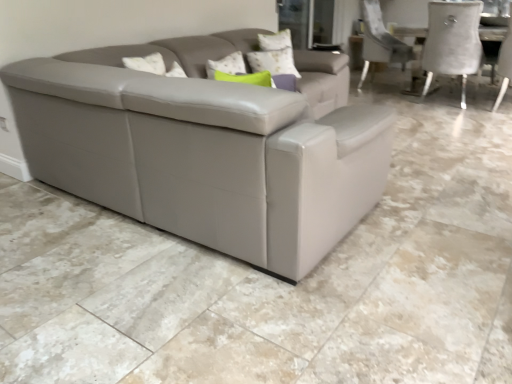
Image resolution: width=512 pixels, height=384 pixels. I want to click on white textured pillow at upper center, so click(x=273, y=61).

The width and height of the screenshot is (512, 384). Describe the element at coordinates (504, 65) in the screenshot. I see `white fabric chair at right` at that location.

You are a GUI agent. You are given a task and a screenshot of the screen. Output one action in this format:
    pyautogui.click(x=<x>, y=<y>)
    Task: Click on the transparent glass door at upper center
    
    Given the screenshot: What is the action you would take?
    pyautogui.click(x=307, y=21)

Considering the sizes of matte gray couch at center and white textured pillow at upper center in the image, is matte gray couch at center taller or shorter than white textured pillow at upper center?

Clearly, matte gray couch at center is shorter compared to white textured pillow at upper center.

Considering the relative sizes of matte gray couch at center and white textured pillow at upper center in the image provided, is matte gray couch at center bigger than white textured pillow at upper center?

Yes.

From the image's perspective, is matte gray couch at center located beneath white textured pillow at upper center?

Correct, matte gray couch at center appears lower than white textured pillow at upper center in the image.

Which is more to the right, matte gray couch at center or white textured pillow at upper center?

matte gray couch at center.

From a real-world perspective, is white textured pillow at upper center under matte gray couch at center?

Actually, white textured pillow at upper center is physically above matte gray couch at center in the real world.

Is white textured pillow at upper center inside or outside of matte gray couch at center?

white textured pillow at upper center exists outside the volume of matte gray couch at center.

Is matte gray couch at center at the back of white textured pillow at upper center?

That's not correct — white textured pillow at upper center is not looking away from matte gray couch at center.

Is point (286, 57) farther from camera compared to point (273, 253)?

Yes, it is behind point (273, 253).

Who is bigger, transparent glass door at upper center or white textured pillow at upper center?

With larger size is transparent glass door at upper center.

From a real-world perspective, is transparent glass door at upper center physically below white textured pillow at upper center?

No, from a real-world perspective, transparent glass door at upper center is not under white textured pillow at upper center.

Between point (303, 17) and point (287, 70), which one is positioned behind?

The point (303, 17) is farther.

Considering the sizes of transparent glass door at upper center and matte gray couch at center in the image, is transparent glass door at upper center wider or thinner than matte gray couch at center?

Clearly, transparent glass door at upper center has less width compared to matte gray couch at center.

What's the angular difference between transparent glass door at upper center and matte gray couch at center's facing directions?

There is a 0.0891-degree angle between the facing directions of transparent glass door at upper center and matte gray couch at center.

This screenshot has height=384, width=512. Find the location of `studio couch located on the right of transparent glass door at upper center`. studio couch located on the right of transparent glass door at upper center is located at coordinates (208, 146).

Looking at the image, does transparent glass door at upper center seem bigger or smaller compared to matte gray couch at center?

Clearly, transparent glass door at upper center is smaller in size than matte gray couch at center.

Relative to matte gray couch at center, is white fabric chair at right in front or behind?

Clearly, white fabric chair at right is behind matte gray couch at center.

Based on the photo, from a real-world perspective, is white fabric chair at right above or below matte gray couch at center?

white fabric chair at right is above matte gray couch at center.

Is white fabric chair at right facing towards matte gray couch at center?

No, white fabric chair at right does not turn towards matte gray couch at center.

From the picture: Considering the relative sizes of white fabric chair at right and matte gray couch at center in the image provided, is white fabric chair at right thinner than matte gray couch at center?

Indeed, white fabric chair at right has a lesser width compared to matte gray couch at center.

Is white textured pillow at upper center far from white fabric chair at right?

Yes, white textured pillow at upper center and white fabric chair at right are quite far apart.

Considering the positions of point (250, 57) and point (507, 58), is point (250, 57) closer or farther from the camera than point (507, 58)?

Point (250, 57) is closer to the camera than point (507, 58).

Is white textured pillow at upper center at the right side of white fabric chair at right?

No, white textured pillow at upper center is not to the right of white fabric chair at right.

Looking at this image, is white textured pillow at upper center outside of white fabric chair at right?

Indeed, white textured pillow at upper center is completely outside white fabric chair at right.

Between matte gray couch at center and transparent glass door at upper center, which one has less height?

matte gray couch at center is shorter.

From a real-world perspective, which is physically below, matte gray couch at center or transparent glass door at upper center?

matte gray couch at center.

Which is more to the right, matte gray couch at center or transparent glass door at upper center?

Positioned to the right is matte gray couch at center.

From the image's perspective, which one is positioned lower, matte gray couch at center or transparent glass door at upper center?

matte gray couch at center.

Image resolution: width=512 pixels, height=384 pixels. Identify the location of studio couch located below the white textured pillow at upper center (from the image's perspective). (208, 146).

Image resolution: width=512 pixels, height=384 pixels. In order to click on pillow above the matte gray couch at center (from the image's perspective) in this screenshot , I will do `click(273, 61)`.

Based on the photo, based on their spatial positions, is white fabric chair at right or matte gray couch at center further from transparent glass door at upper center?

Among the two, matte gray couch at center is located further to transparent glass door at upper center.

Based on their spatial positions, is matte gray couch at center or white fabric chair at right closer to transparent glass door at upper center?

white fabric chair at right lies closer to transparent glass door at upper center than the other object.

When comparing their distances from white fabric chair at right, does transparent glass door at upper center or white textured pillow at upper center seem further?

Among the two, white textured pillow at upper center is located further to white fabric chair at right.

Considering their positions, is white textured pillow at upper center positioned further to transparent glass door at upper center than matte gray couch at center?

matte gray couch at center is positioned further to the anchor transparent glass door at upper center.

When comparing their distances from matte gray couch at center, does white fabric chair at right or transparent glass door at upper center seem further?

white fabric chair at right lies further to matte gray couch at center than the other object.

Estimate the real-world distances between objects in this image. Which object is closer to white textured pillow at upper center, white fabric chair at right or transparent glass door at upper center?

transparent glass door at upper center.

Looking at the image, which one is located closer to white fabric chair at right, matte gray couch at center or white textured pillow at upper center?

Based on the image, white textured pillow at upper center appears to be nearer to white fabric chair at right.

Based on their spatial positions, is matte gray couch at center or transparent glass door at upper center closer to white textured pillow at upper center?

matte gray couch at center is positioned closer to the anchor white textured pillow at upper center.

Locate an element on the screen. Image resolution: width=512 pixels, height=384 pixels. chair positioned between matte gray couch at center and transparent glass door at upper center from near to far is located at coordinates (504, 65).

Identify the location of pillow between matte gray couch at center and transparent glass door at upper center along the z-axis. This screenshot has width=512, height=384. (273, 61).

You are a GUI agent. You are given a task and a screenshot of the screen. Output one action in this format:
    pyautogui.click(x=<x>, y=<y>)
    Task: Click on the glass door situated between white textured pillow at upper center and white fabric chair at right from left to right
    This screenshot has height=384, width=512.
    Given the screenshot: What is the action you would take?
    pyautogui.click(x=307, y=21)

Find the location of a particular element. Image resolution: width=512 pixels, height=384 pixels. pillow positioned between matte gray couch at center and white fabric chair at right from near to far is located at coordinates (273, 61).